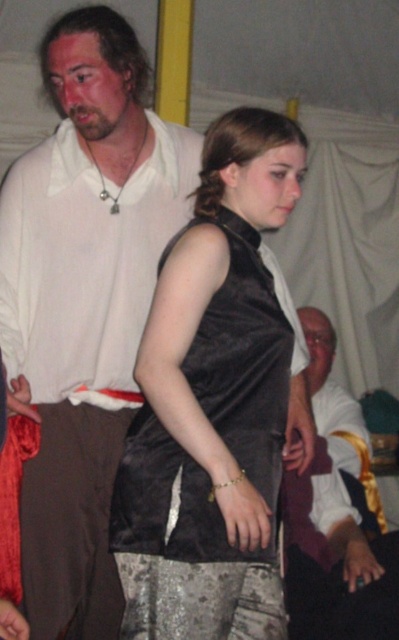
Question: Among these points, which one is nearest to the camera?

Choices:
 (A) (221, 248)
 (B) (116, 36)
 (C) (316, 477)

Answer: (A)

Question: Does satin black vest at center have a smaller size compared to silky white shirt at center?

Choices:
 (A) yes
 (B) no

Answer: (A)

Question: Can you confirm if matte white shirt at upper left is positioned below satin black vest at center?

Choices:
 (A) no
 (B) yes

Answer: (A)

Question: Can you confirm if satin black vest at center is wider than silky white shirt at center?

Choices:
 (A) yes
 (B) no

Answer: (A)

Question: Estimate the real-world distances between objects in this image. Which object is farther from the silky white shirt at center?

Choices:
 (A) matte white shirt at upper left
 (B) satin black vest at center

Answer: (A)

Question: Which object is the farthest from the satin black vest at center?

Choices:
 (A) matte white shirt at upper left
 (B) silky white shirt at center

Answer: (B)